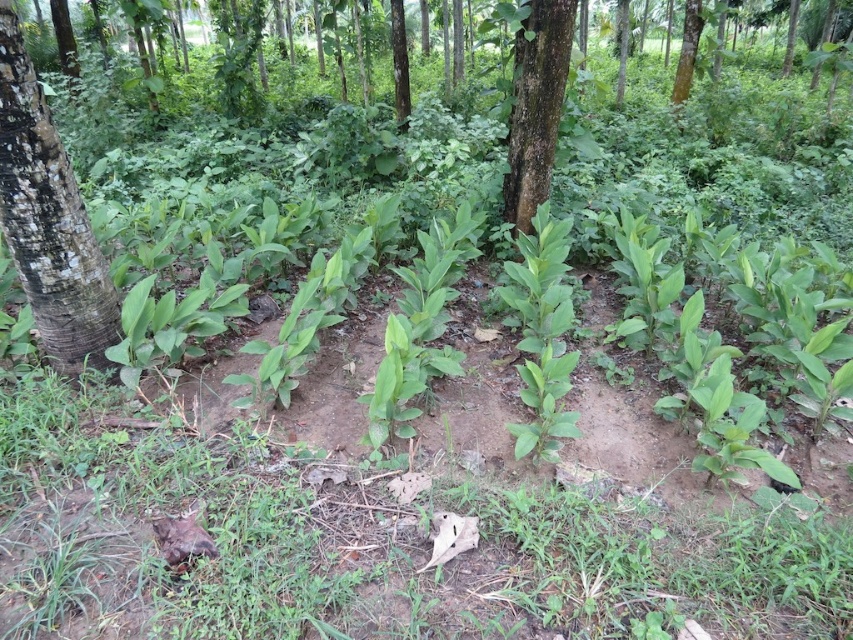
The height and width of the screenshot is (640, 853). Find the location of `rough bark tree trunk at left`. rough bark tree trunk at left is located at coordinates (48, 220).

Does rough bark tree trunk at left have a greater width compared to rough bark tree trunk at center?

In fact, rough bark tree trunk at left might be narrower than rough bark tree trunk at center.

This screenshot has width=853, height=640. I want to click on rough bark tree trunk at left, so pos(48,220).

Locate an element on the screen. Image resolution: width=853 pixels, height=640 pixels. rough bark tree trunk at left is located at coordinates (48, 220).

Is rough bark tree trunk at center positioned in front of smooth brown tree trunk at upper right?

Result: Yes, rough bark tree trunk at center is in front of smooth brown tree trunk at upper right.

Does rough bark tree trunk at center have a greater height compared to smooth brown tree trunk at upper right?

Yes, rough bark tree trunk at center is taller than smooth brown tree trunk at upper right.

Between point (538, 125) and point (695, 45), which one is positioned in front?

Point (538, 125)

Locate an element on the screen. The height and width of the screenshot is (640, 853). rough bark tree trunk at center is located at coordinates (537, 106).

Who is lower down, rough bark tree trunk at left or smooth brown tree trunk at upper right?

rough bark tree trunk at left is lower down.

Can you confirm if rough bark tree trunk at left is taller than smooth brown tree trunk at upper right?

Indeed, rough bark tree trunk at left has a greater height compared to smooth brown tree trunk at upper right.

Does point (44, 282) come farther from viewer compared to point (688, 28)?

No, (44, 282) is closer to viewer.

Image resolution: width=853 pixels, height=640 pixels. What are the coordinates of `rough bark tree trunk at left` in the screenshot? It's located at (48, 220).